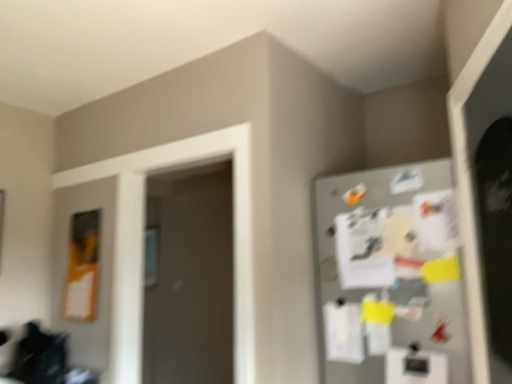
What do you see at coordinates (390, 277) in the screenshot? Image resolution: width=512 pixels, height=384 pixels. I see `metallic gray fridge at right` at bounding box center [390, 277].

This screenshot has height=384, width=512. Find the location of `metallic gray fridge at right`. metallic gray fridge at right is located at coordinates pyautogui.click(x=390, y=277).

Locate an element on the screen. The image size is (512, 384). metallic gray fridge at right is located at coordinates (390, 277).